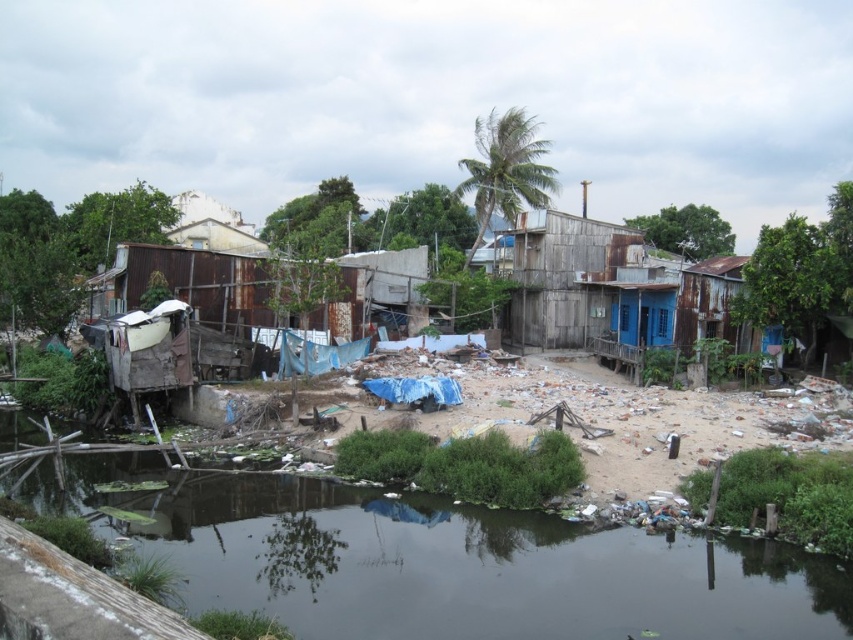
How far apart are rusty metal shack at center-left and rusty wood shack at center?

rusty metal shack at center-left and rusty wood shack at center are 42.46 feet apart.

Measure the distance between rusty metal shack at center-left and camera.

rusty metal shack at center-left is 20.33 meters from camera.

I want to click on rusty metal shack at center-left, so click(223, 289).

Is dark green water at lower center bigger than rusty metal shack at center-left?

No.

Which is behind, point (387, 509) or point (206, 266)?

The point (206, 266) is more distant.

Is point (189, 552) farther from viewer compared to point (277, 262)?

That is False.

Image resolution: width=853 pixels, height=640 pixels. Identify the location of dark green water at lower center. (459, 564).

Can you confirm if rusty wood shack at center is shorter than rusty metal shack at right?

Indeed, rusty wood shack at center has a lesser height compared to rusty metal shack at right.

Between point (532, 250) and point (727, 278), which one is positioned behind?

The point (532, 250) is behind.

This screenshot has height=640, width=853. Find the location of `rusty wood shack at center`. rusty wood shack at center is located at coordinates (556, 275).